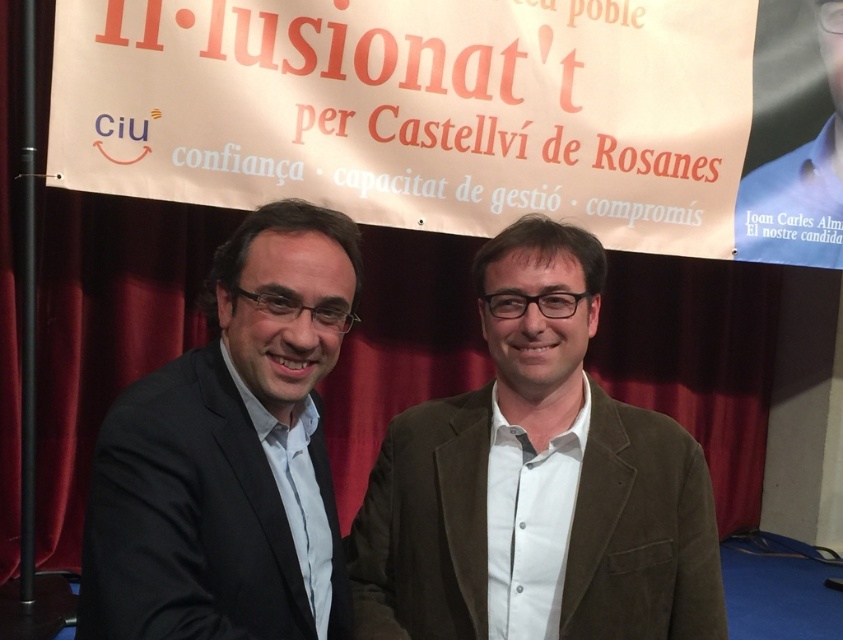
Is matte black suit at left bigger than blue fabric at upper right?

No.

Find the location of a particular element. matte black suit at left is located at coordinates pyautogui.click(x=229, y=454).

Who is more forward, (196, 388) or (772, 8)?

Point (196, 388)

Locate an element on the screen. matte black suit at left is located at coordinates (229, 454).

Based on the photo, does suede brown blazer at center appear on the left side of blue fabric at upper right?

Correct, you'll find suede brown blazer at center to the left of blue fabric at upper right.

Is suede brown blazer at center behind blue fabric at upper right?

No, suede brown blazer at center is closer to the viewer.

Consider the image. Who is more forward, [481,531] or [792,52]?

Point [481,531] is more forward.

The width and height of the screenshot is (843, 640). What are the coordinates of `suede brown blazer at center` in the screenshot? It's located at (535, 483).

Who is more forward, (380, 451) or (151, 410)?

Point (151, 410) is in front.

Who is taller, suede brown blazer at center or matte black suit at left?

suede brown blazer at center is taller.

I want to click on suede brown blazer at center, so click(535, 483).